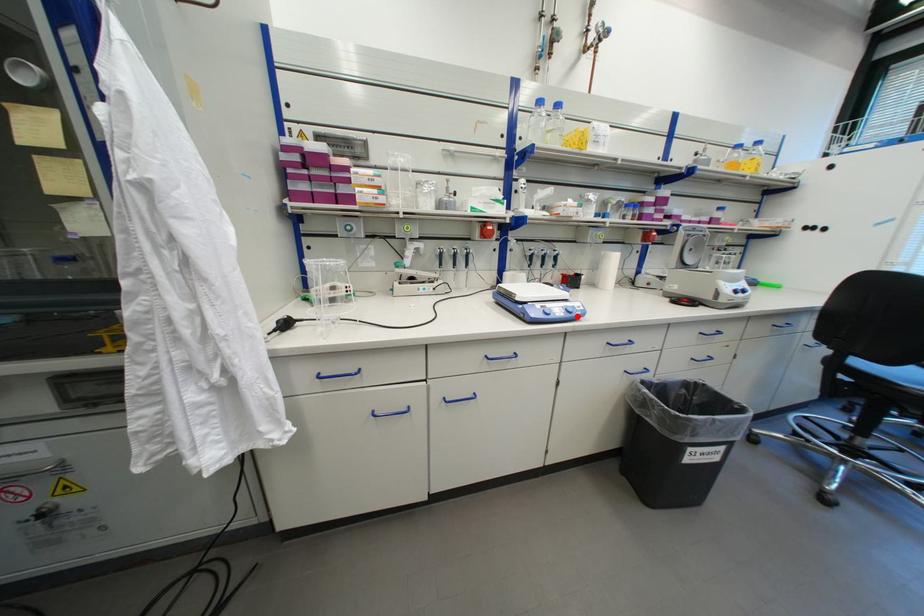
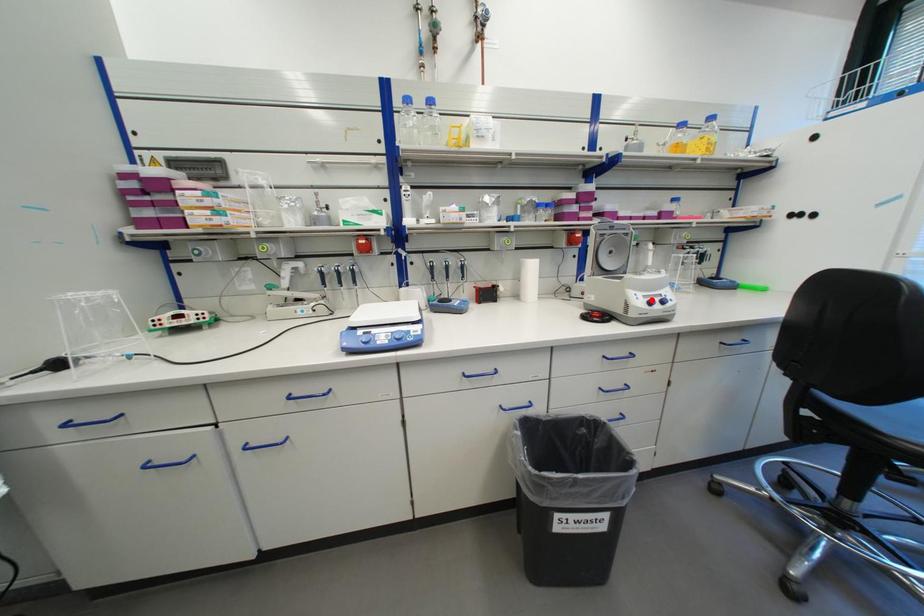
I am providing you with two images of the same scene from different viewpoints. A red point is marked on the first image and another point is marked on the second image. Are the points marked in image1 and image2 representing the same 3D position?

No